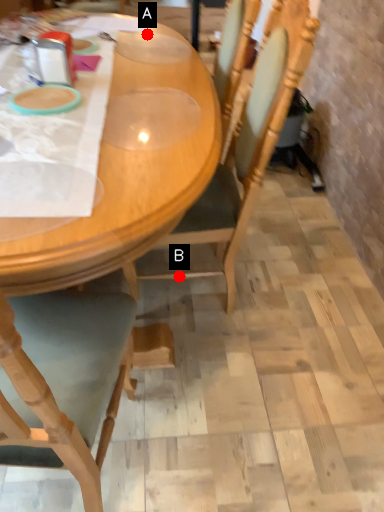
Question: Two points are circled on the image, labeled by A and B beside each circle. Which point is closer to the camera?

Choices:
 (A) A is closer
 (B) B is closer

Answer: (B)